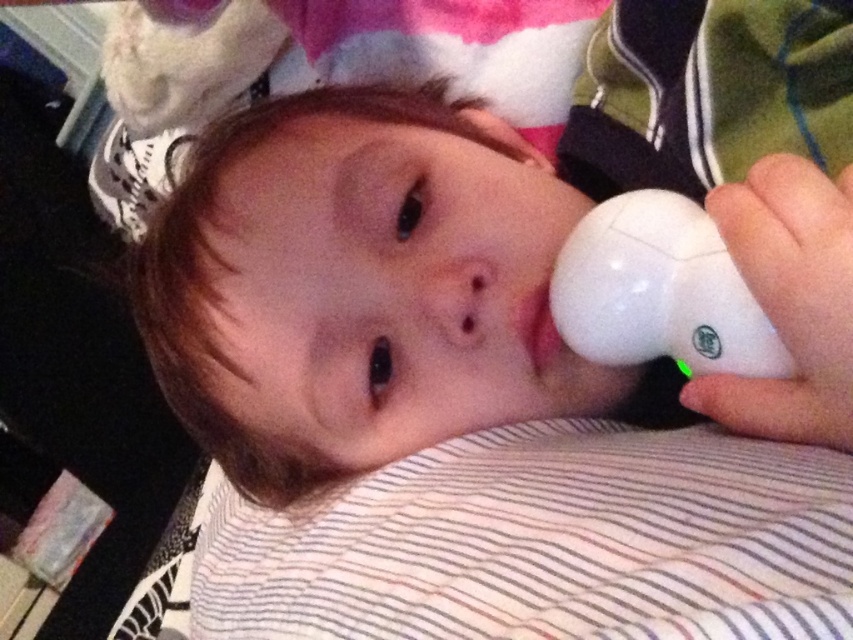
From the picture: Who is taller, white matte pacifier at center or white matte remote control at lower right?

With more height is white matte pacifier at center.

Can you confirm if white matte pacifier at center is smaller than white matte remote control at lower right?

No, white matte pacifier at center is not smaller than white matte remote control at lower right.

Image resolution: width=853 pixels, height=640 pixels. What do you see at coordinates (451, 240) in the screenshot?
I see `white matte pacifier at center` at bounding box center [451, 240].

Locate an element on the screen. Image resolution: width=853 pixels, height=640 pixels. white matte pacifier at center is located at coordinates (451, 240).